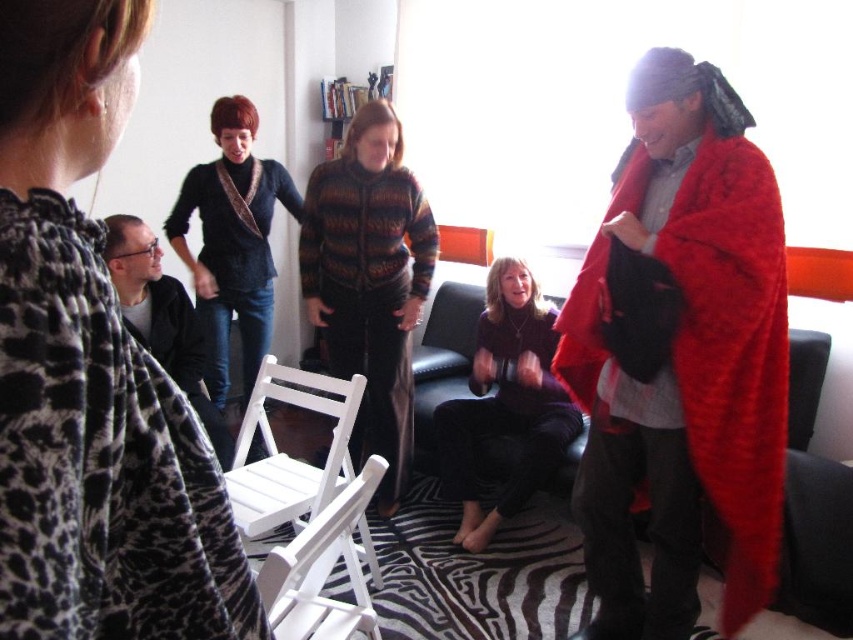
You are sitting on the white wood chair at center and want to move to the black leather chair at center. Which direction should you move in to reach it?

The white wood chair at center is closer to the viewer than the black leather chair at center, so you should move backward to reach the black leather chair at center.

You are standing at the entrance of the room and want to sit down. There are two white wood chairs in view. Which one is closer to you, the white wood chair at lower left or the white wood chair at center?

The white wood chair at lower left is closer to you because it is further to the viewer than the white wood chair at center, meaning it is positioned nearer in the room.